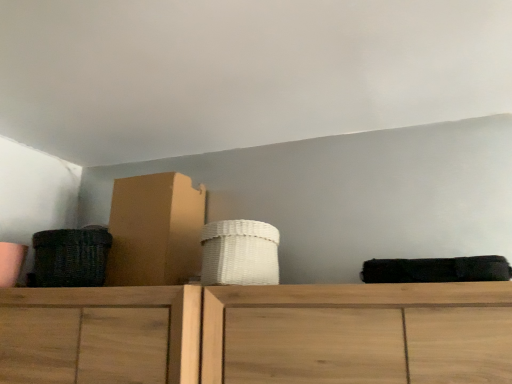
Question: In the image, is cardboard box at left on the left side or the right side of dark brown woven basket at left, which is counted as the 1th basket, starting from the left?

Choices:
 (A) right
 (B) left

Answer: (A)

Question: Considering their positions, is cardboard box at left located in front of or behind dark brown woven basket at left, which is counted as the 1th basket, starting from the left?

Choices:
 (A) front
 (B) behind

Answer: (B)

Question: Estimate the real-world distances between objects in this image. Which object is closer to the dark brown woven basket at left, placed as the second basket when sorted from right to left?

Choices:
 (A) white woven basket at center, which is counted as the 2th basket, starting from the left
 (B) cardboard box at left

Answer: (B)

Question: Which object is the closest to the white woven basket at center, positioned as the first basket in right-to-left order?

Choices:
 (A) cardboard box at left
 (B) dark brown woven basket at left, placed as the second basket when sorted from right to left

Answer: (A)